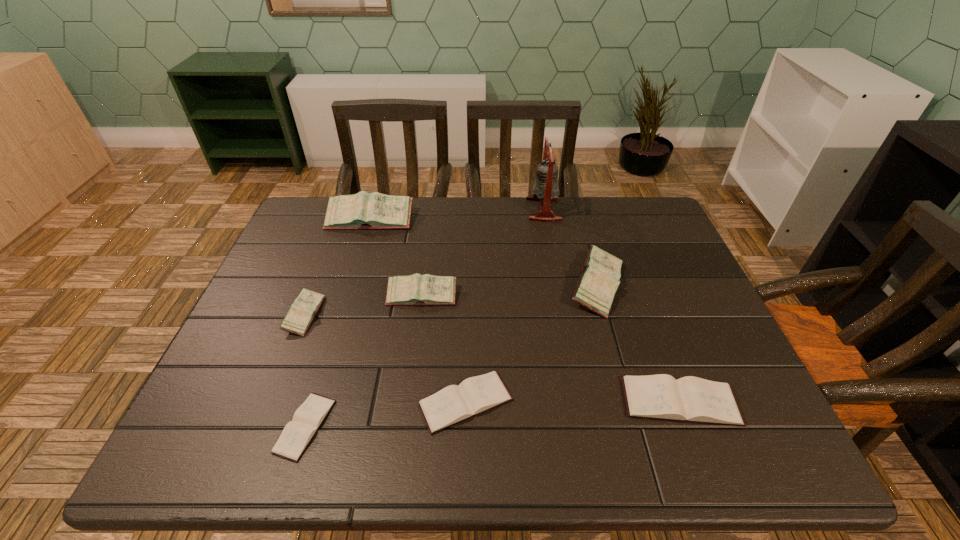
The height and width of the screenshot is (540, 960). What are the coordinates of `blank space located 0.250m on the back of the biggest brown diary` in the screenshot? It's located at (640, 294).

You are a GUI agent. You are given a task and a screenshot of the screen. Output one action in this format:
    pyautogui.click(x=<x>, y=<y>)
    Task: Click on the free space located 0.150m on the right of the second smallest brown diary
    
    Given the screenshot: What is the action you would take?
    pyautogui.click(x=588, y=402)

This screenshot has height=540, width=960. What are the coordinates of `vacant position located 0.390m on the back of the shortest object` in the screenshot? It's located at (354, 268).

The height and width of the screenshot is (540, 960). Find the location of `bell that is at the far edge`. bell that is at the far edge is located at coordinates (545, 189).

Where is `diary at the far edge`? The image size is (960, 540). diary at the far edge is located at coordinates (364, 210).

Where is `object that is at the right edge`? Image resolution: width=960 pixels, height=540 pixels. object that is at the right edge is located at coordinates (688, 399).

At what (x,y) coordinates should I click in order to perform the action: click on object that is at the far left corner. Please return your answer as a coordinate pair (x, y). This screenshot has width=960, height=540. Looking at the image, I should click on (364, 210).

Locate an element on the screen. This screenshot has width=960, height=540. object that is positioned at the near right corner is located at coordinates pos(688,399).

Where is `free space at the far edge`? The image size is (960, 540). free space at the far edge is located at coordinates (591, 201).

The image size is (960, 540). I want to click on free space at the near edge of the desktop, so click(x=349, y=427).